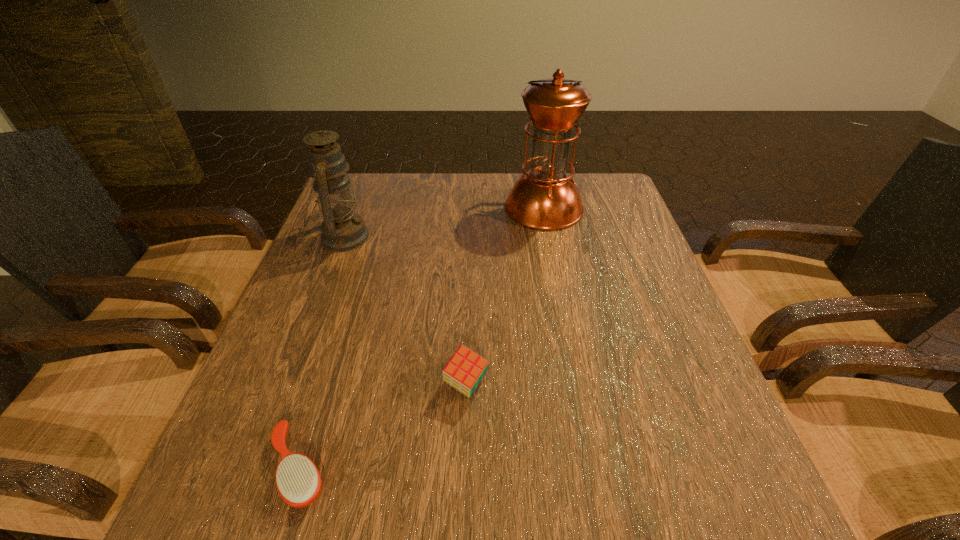
This screenshot has height=540, width=960. I want to click on vacant region located 0.190m on the right of the third tallest object, so click(588, 384).

Locate an element on the screen. The height and width of the screenshot is (540, 960). free space located on the right of the shortest object is located at coordinates coord(546,468).

Locate an element on the screen. object that is at the far edge is located at coordinates (545, 198).

You are a GUI agent. You are given a task and a screenshot of the screen. Output one action in this format:
    pyautogui.click(x=<x>, y=<y>)
    Task: Click on the object that is at the near edge
    
    Given the screenshot: What is the action you would take?
    pyautogui.click(x=298, y=481)

This screenshot has width=960, height=540. What are the coordinates of `oil lamp present at the left edge` in the screenshot? It's located at (342, 230).

Identify the location of hairbrush located in the left edge section of the desktop. This screenshot has height=540, width=960. (298, 481).

Find the location of a particular element. The image size is (960, 540). object located at the right edge is located at coordinates 545,198.

At what (x,y) coordinates should I click in order to perform the action: click on object that is at the near left corner. Please return your answer as a coordinate pair (x, y). This screenshot has height=540, width=960. Looking at the image, I should click on (298, 481).

In order to click on object at the far right corner in this screenshot , I will do `click(545, 198)`.

Locate an element on the screen. This screenshot has width=960, height=540. free space at the far edge of the desktop is located at coordinates (471, 191).